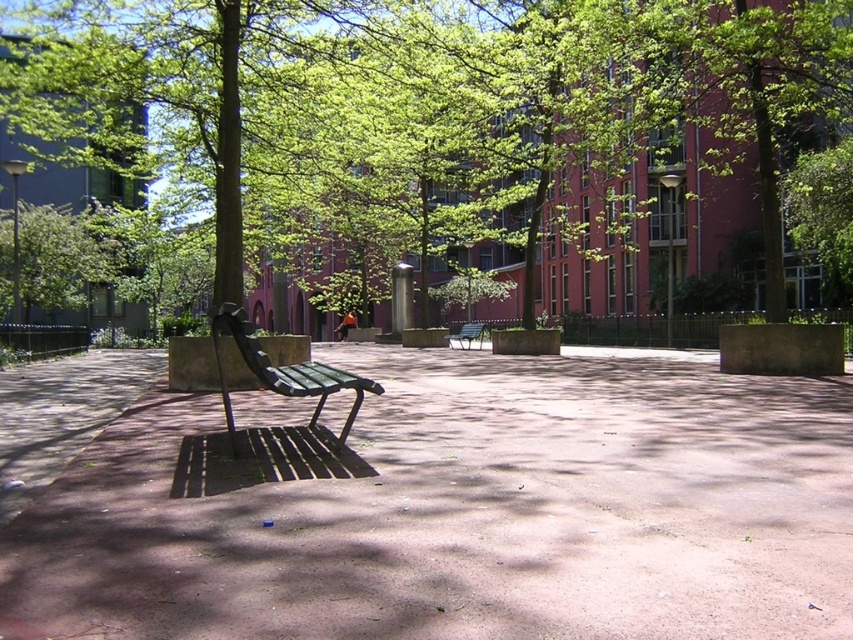
You are standing in the park and want to place a small decorative statue between the two points labeled as point [47,528] and point [463,337]. Which point should the statue be closer to if you want it to be nearer to the wooden bench?

The statue should be placed closer to point [47,528] because it is closer to the viewer, which is where the wooden bench is located.

You are sitting on the wooden bench at center and want to move to the green leafy tree at center. Which direction should you face to walk directly towards the tree?

Since the green leafy tree at center is larger in size than the wooden bench at center, you should face forward to walk directly towards the green leafy tree at center from the wooden bench at center.